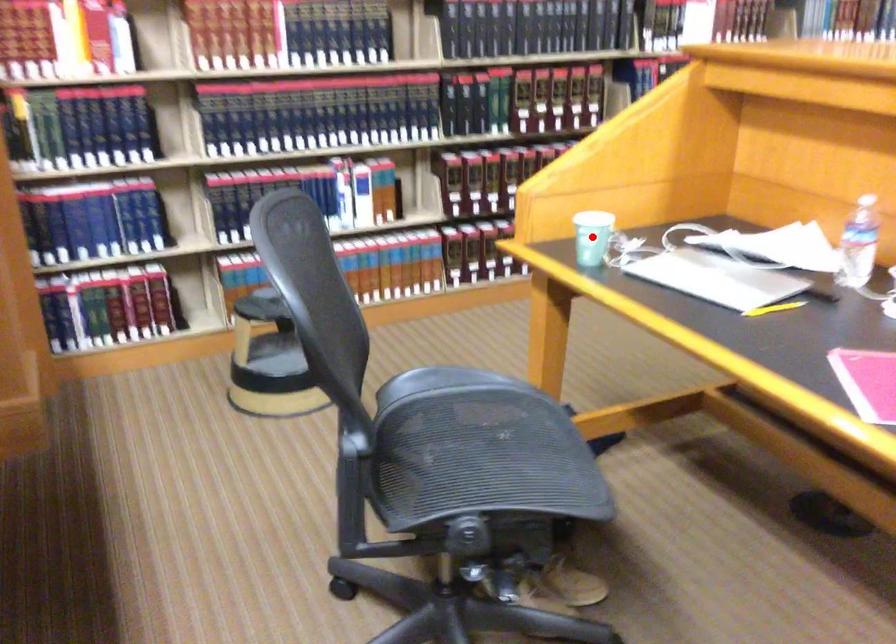
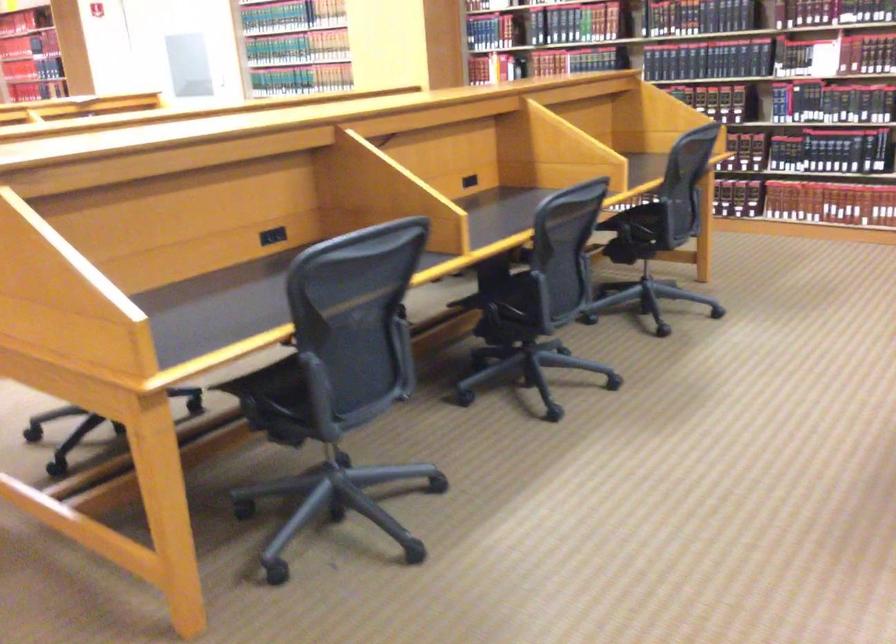
Question: I am providing you with two images of the same scene from different viewpoints. A red point is marked on the first image. Can you still see the location of the red point in image 2?

Choices:
 (A) Yes
 (B) No

Answer: (B)